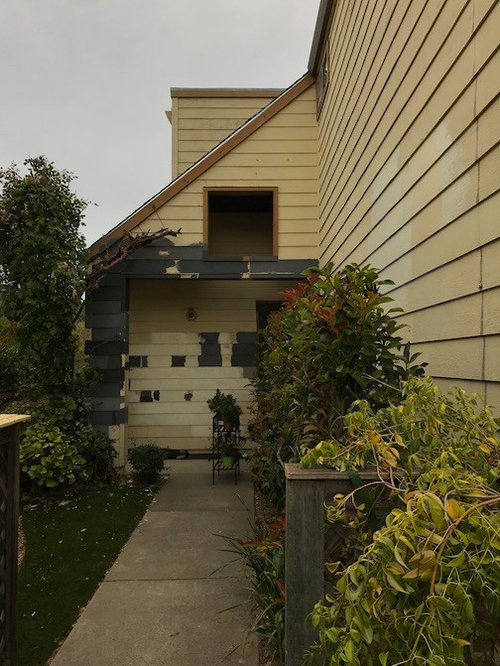
You are a GUI agent. You are given a task and a screenshot of the screen. Output one action in this format:
    pyautogui.click(x=<x>, y=<y>)
    Task: Click on the shelving unit
    
    Given the screenshot: What is the action you would take?
    pyautogui.click(x=224, y=434)